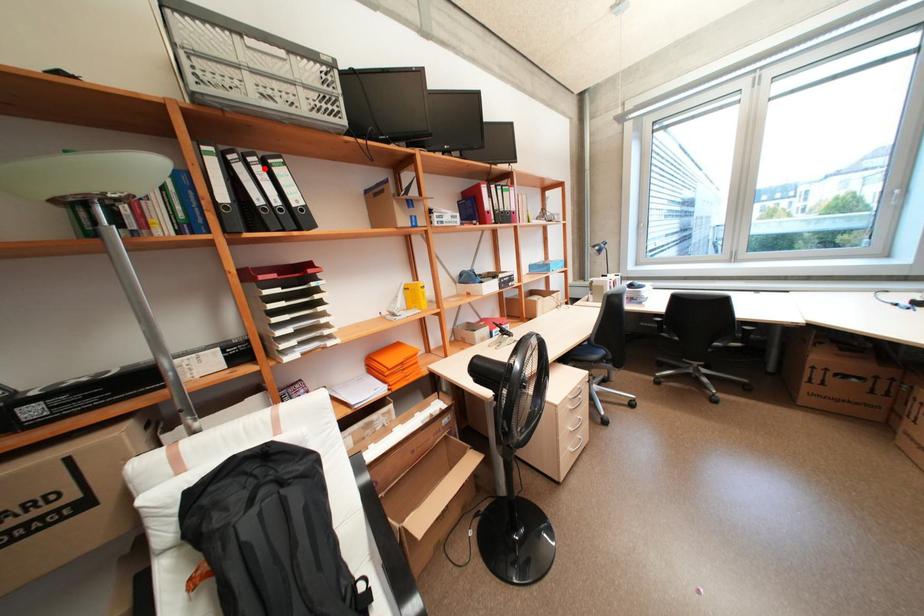
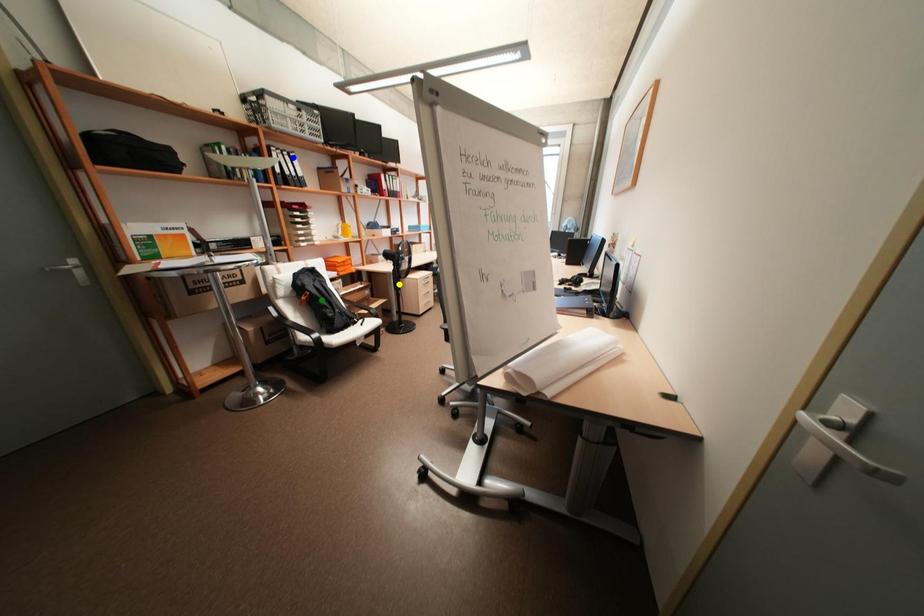
Question: I am providing you with two images of the same scene from different viewpoints. A red point is marked on the first image. You are given multiple points on the second image. Which point in image 2 is actually the same real-world point as the red point in image 1?

Choices:
 (A) blue point
 (B) yellow point
 (C) green point

Answer: (A)